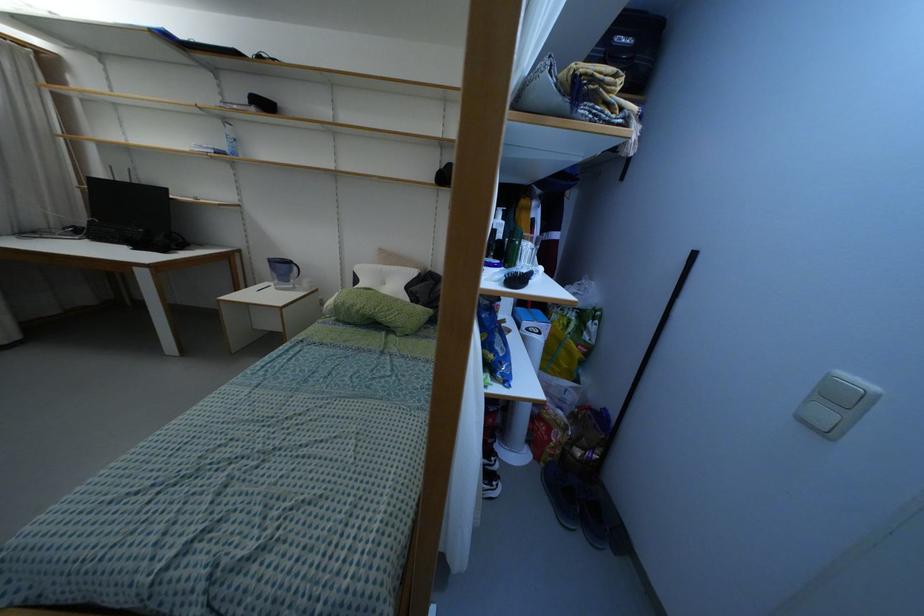
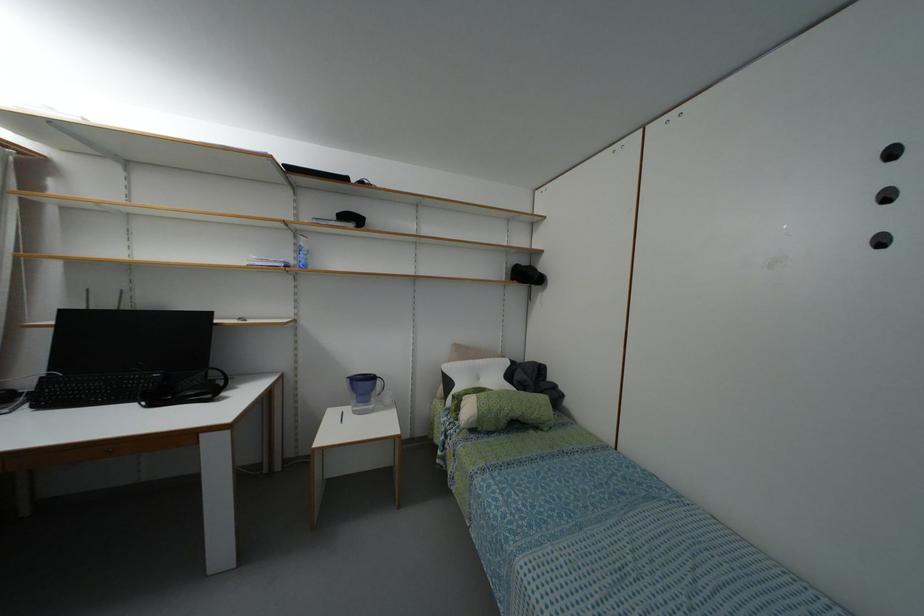
Question: The images are taken continuously from a first-person perspective. In which direction are you moving?

Choices:
 (A) Left
 (B) Right
 (C) Forward
 (D) Backward

Answer: (A)